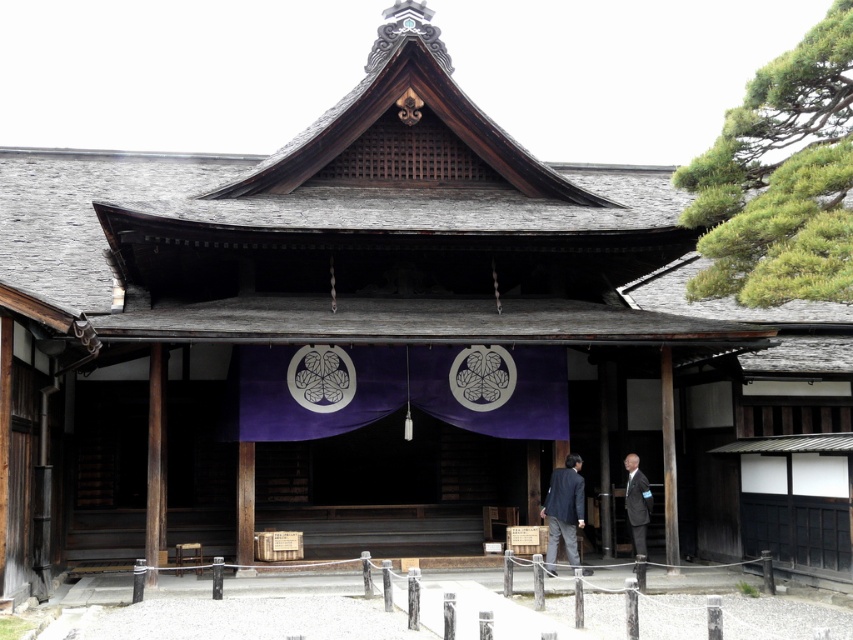
You are standing at the entrance of the traditional Japanese building and see the dark blue suit at center and the brown wooden pillar at center. If you want to reach both objects, which one is closer to you?

Both the dark blue suit at center and the brown wooden pillar at center are at the same distance from you since they are both at the center.

You are standing in front of the traditional Japanese building and want to locate two specific points marked on the building. The first point is at coordinate point [670,387] and the second is at point [646,483]. Which of these two points is closer to you?

Point [670,387] is in front of point [646,483], so it is closer to you.